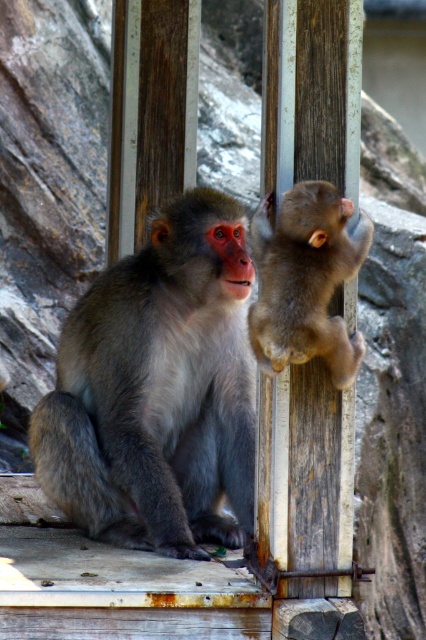
From the picture: Which is above, gray fur monkey at center or brown furry monkey at upper right?

Positioned higher is brown furry monkey at upper right.

Can you confirm if gray fur monkey at center is taller than brown furry monkey at upper right?

Yes, gray fur monkey at center is taller than brown furry monkey at upper right.

In order to click on gray fur monkey at center in this screenshot , I will do `click(158, 388)`.